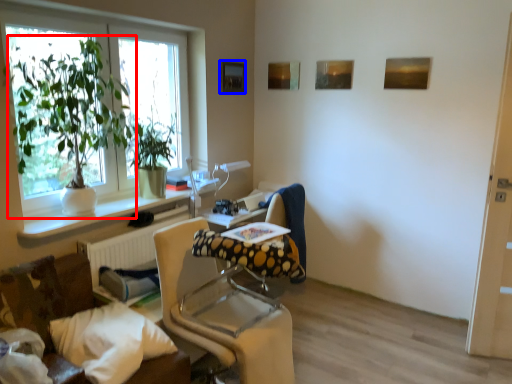
Question: Which of the following is the farthest to the observer, houseplant (highlighted by a red box) or picture frame (highlighted by a blue box)?

Choices:
 (A) houseplant
 (B) picture frame

Answer: (B)